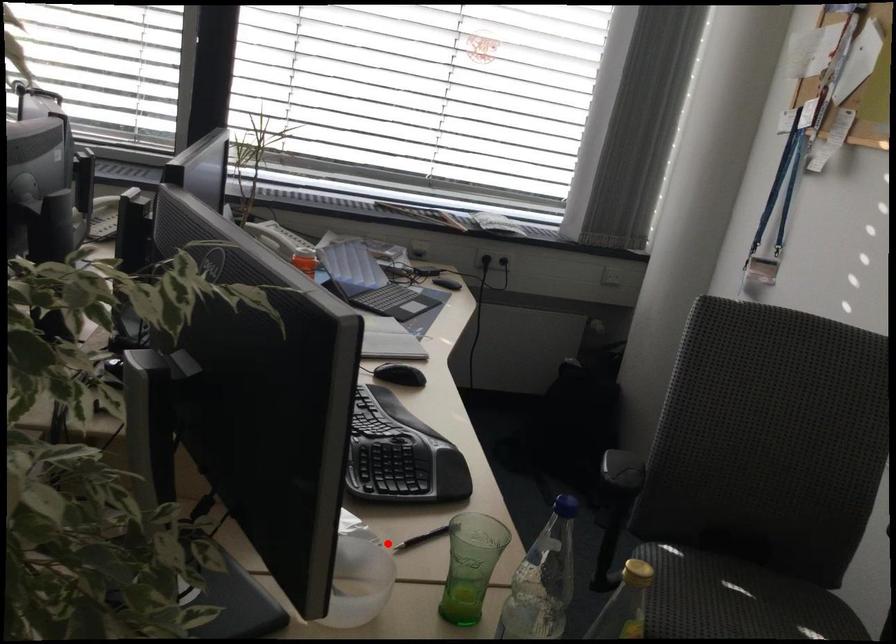
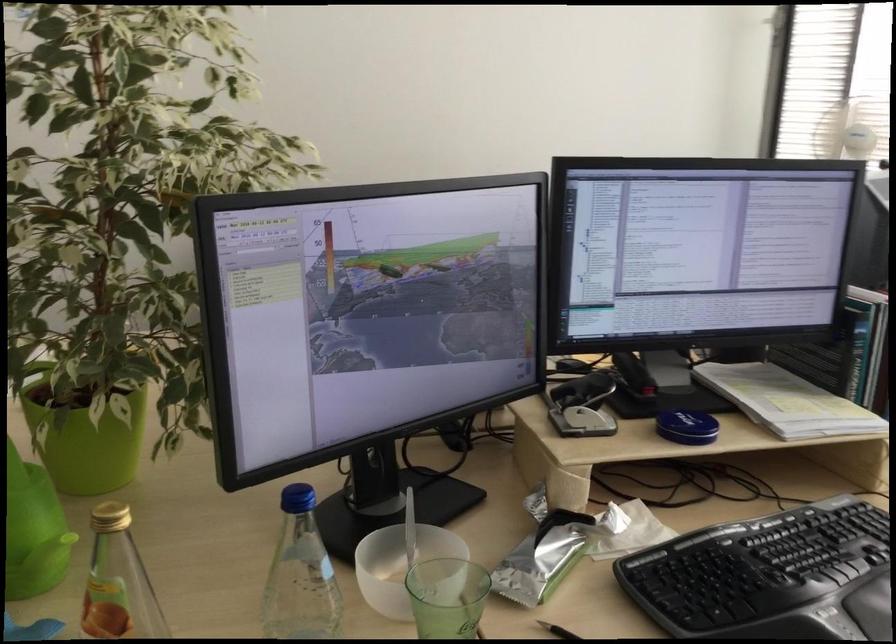
Question: I am providing you with two images of the same scene from different viewpoints. Given a red point in image1, look at the same physical point in image2. Is it:

Choices:
 (A) Closer to the viewpoint
 (B) Farther from the viewpoint

Answer: (A)